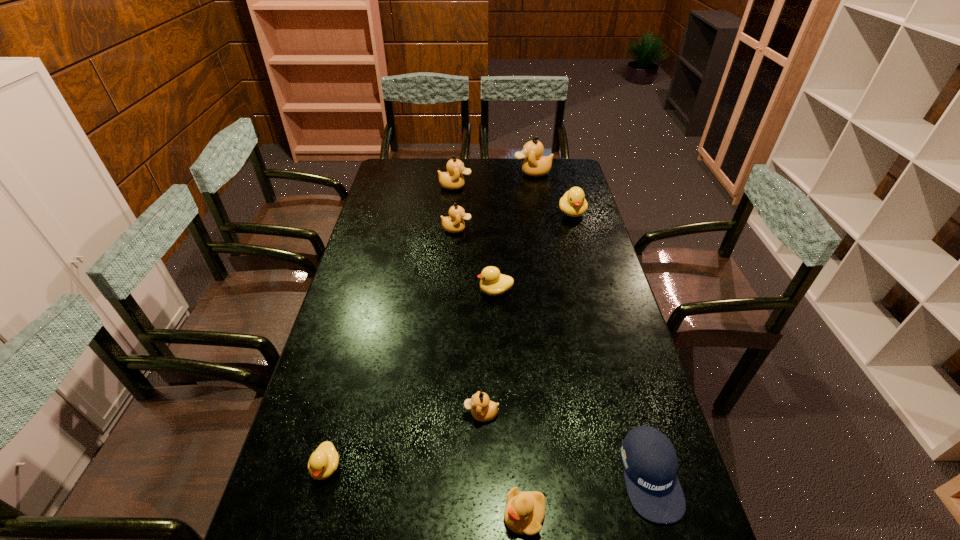
Locate an element on the screen. the nearest tan duckling is located at coordinates (483, 409).

Where is `blue baseball cap`? The image size is (960, 540). blue baseball cap is located at coordinates (650, 464).

The height and width of the screenshot is (540, 960). What are the coordinates of `the nearest yellow duckling` in the screenshot? It's located at (524, 512).

The height and width of the screenshot is (540, 960). I want to click on the second nearest duckling, so click(x=324, y=460).

Identify the location of the leftmost yellow duckling. (324, 460).

In order to click on vacant space located on the face of the farthest object in this screenshot , I will do `click(452, 172)`.

What are the coordinates of `free location located on the face of the farthest object` in the screenshot? It's located at (501, 172).

You are a GUI agent. You are given a task and a screenshot of the screen. Output one action in this format:
    pyautogui.click(x=<x>, y=<y>)
    Task: Click on the free space located on the face of the farthest object
    Image resolution: width=960 pixels, height=540 pixels.
    Given the screenshot: What is the action you would take?
    pyautogui.click(x=465, y=172)

In order to click on vacant region located 0.280m on the face of the eighth nearest object in this screenshot , I will do `click(534, 186)`.

Identify the location of free region located on the beak of the rightmost yellow duckling. (584, 256).